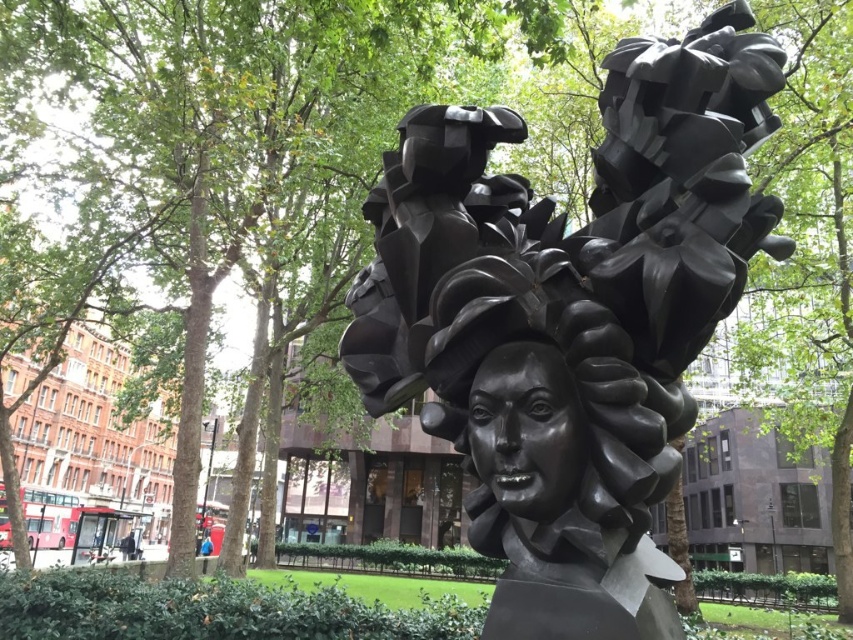
You are an art student analyzing two bust sculptures in a park. The polished bronze bust at center and the shiny black bust at center are both in front of you. Which one has a greater width?

The polished bronze bust at center has a greater width than the shiny black bust at center.

You are a photographer setting up a tripod to capture both the polished bronze bust at center and the shiny black bust at center in the same frame. Given that your camera lens has a maximum focal length that allows for a field of view covering 10 inches, will you be able to include both busts in your shot without moving the tripod?

The distance between the polished bronze bust at center and the shiny black bust at center is 8.94 inches, which is within the 10 inches field of view of your camera lens. Therefore, you can capture both busts in the same frame without moving the tripod.

You are an art student analyzing two bust sculptures in a park. You notice the polished bronze bust at center and the shiny black bust at center. Which one appears larger in size?

The polished bronze bust at center is bigger than the shiny black bust at center.